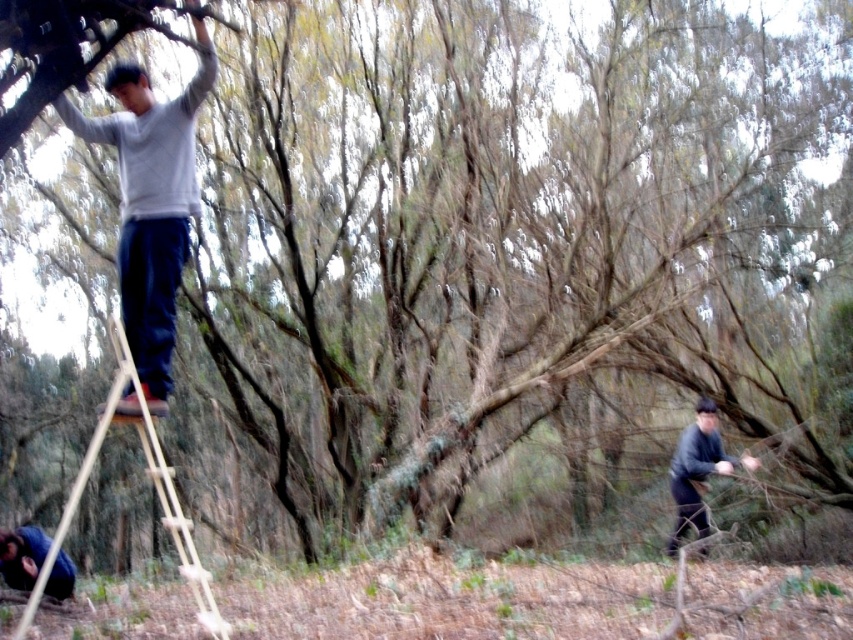
Question: Which object is farther from the camera taking this photo?

Choices:
 (A) dark gray sweater at lower right
 (B) blue denim jacket at lower left
 (C) light gray sweater at upper left
 (D) wooden natural ladder at upper left

Answer: (A)

Question: Is light gray sweater at upper left thinner than wooden natural ladder at upper left?

Choices:
 (A) yes
 (B) no

Answer: (A)

Question: Is light gray sweater at upper left further to camera compared to dark gray sweater at lower right?

Choices:
 (A) yes
 (B) no

Answer: (B)

Question: Is light gray sweater at upper left wider than blue denim jacket at lower left?

Choices:
 (A) no
 (B) yes

Answer: (B)

Question: Which point is farther to the camera?

Choices:
 (A) (717, 406)
 (B) (32, 541)
 (C) (165, 129)

Answer: (A)

Question: Which of the following is the farthest from the observer?

Choices:
 (A) (683, 484)
 (B) (152, 262)

Answer: (A)